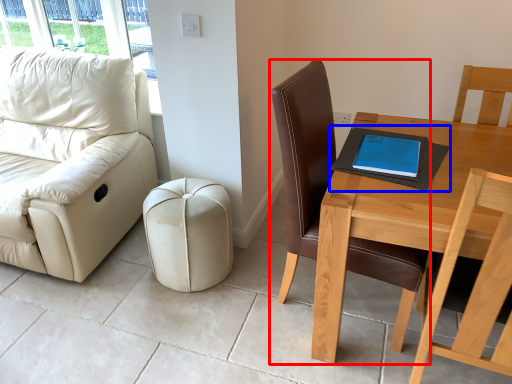
Question: Which point is further to the camera, chair (highlighted by a red box) or notebook (highlighted by a blue box)?

Choices:
 (A) chair
 (B) notebook

Answer: (B)